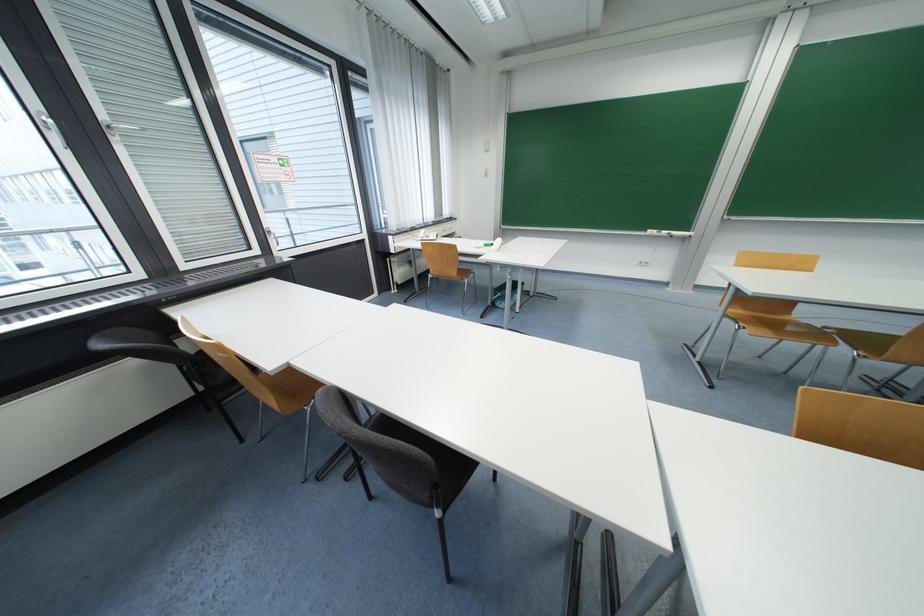
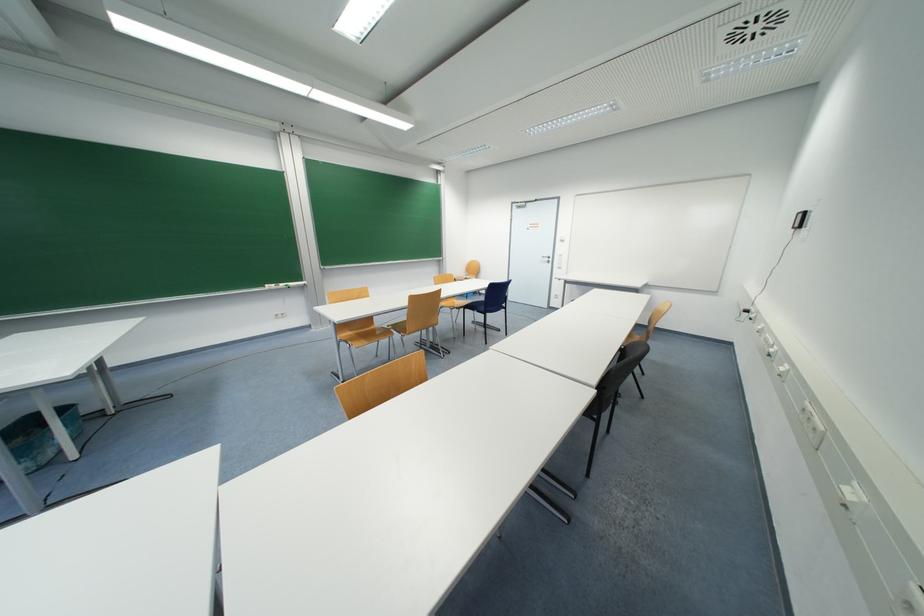
Question: The images are taken continuously from a first-person perspective. In which direction is your viewpoint rotating?

Choices:
 (A) Left
 (B) Right
 (C) Up
 (D) Down

Answer: (B)